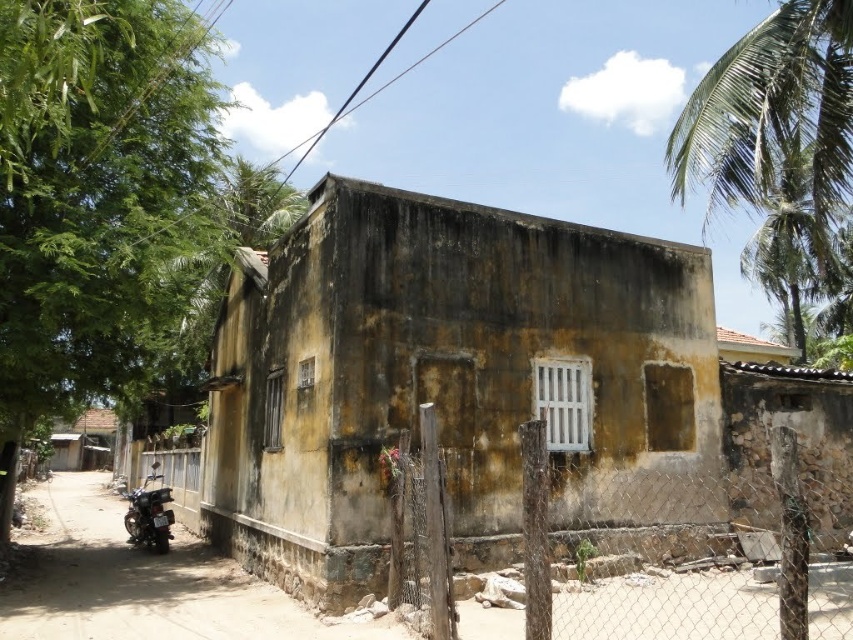
You are standing in front of the building and want to enter through the door. There is a wooden post at center and a green leafy palm tree at upper right in your view. Which object is closer to you?

The wooden post at center is closer to you because it is in front of the green leafy palm tree at upper right.

You are a delivery drone flying over the smooth concrete alley at lower left and the green leafy palm tree at upper right. Which object is shorter in height?

The smooth concrete alley at lower left is shorter in height compared to the green leafy palm tree at upper right.

You are standing in front of the building and want to place a small decorative item at point (633, 636) and another at point (845, 88). Which point is closer to you?

Point (633, 636) is closer to the camera than point (845, 88), so you should place the decorative item there first if you want it nearer.